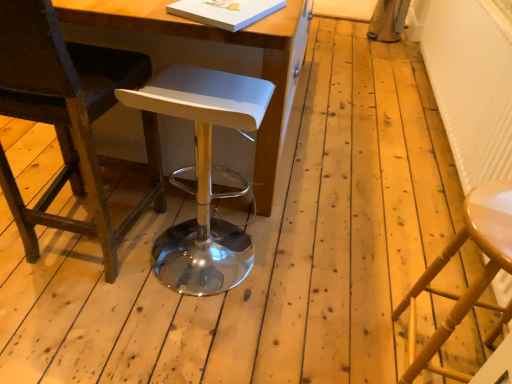
Find the location of `vacant area that lies to the right of wooden table at center`. vacant area that lies to the right of wooden table at center is located at coordinates (357, 144).